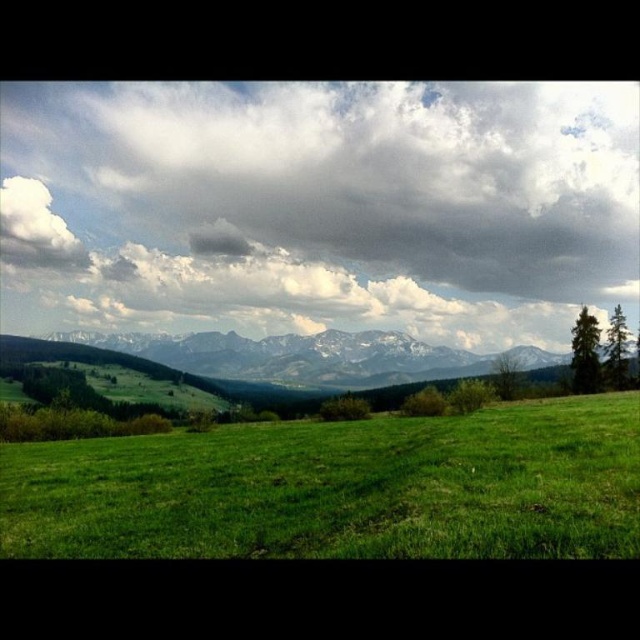
Question: Which point is closer to the camera?

Choices:
 (A) (573, 403)
 (B) (22, 252)
 (C) (211, 346)

Answer: (A)

Question: Estimate the real-world distances between objects in this image. Which object is farther from the white snow-covered mountain range at center?

Choices:
 (A) white fluffy cloud at upper left
 (B) green grassy field at lower center
 (C) cloudy sky at upper center

Answer: (B)

Question: Can you confirm if cloudy sky at upper center is positioned above white snow-covered mountain range at center?

Choices:
 (A) no
 (B) yes

Answer: (B)

Question: Can you confirm if white snow-covered mountain range at center is bigger than white fluffy cloud at upper left?

Choices:
 (A) no
 (B) yes

Answer: (B)

Question: In this image, where is cloudy sky at upper center located relative to white fluffy cloud at upper left?

Choices:
 (A) above
 (B) below

Answer: (A)

Question: Among these objects, which one is nearest to the camera?

Choices:
 (A) cloudy sky at upper center
 (B) green grassy field at lower center
 (C) white fluffy cloud at upper left
 (D) white snow-covered mountain range at center

Answer: (B)